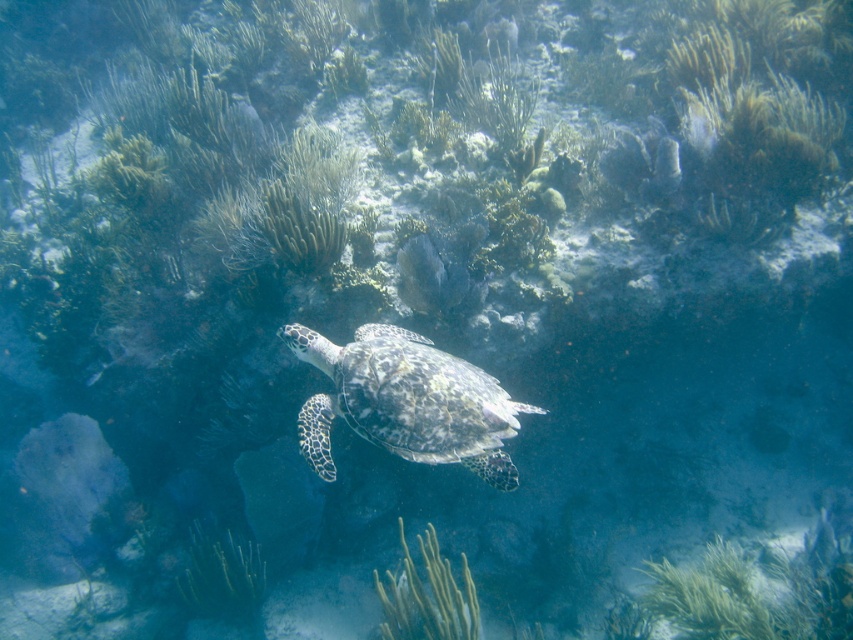
You are a marine biologist observing the underwater scene. You notice two points marked in the image. Which point is closer to you, point (399, 403) or point (392, 602)?

Point (399, 403) is closer to the viewer than point (392, 602).

You are a marine biologist observing the underwater scene. You notice the speckled shell turtle at center and the green soft coral at center. Which object is taller in this environment?

The green soft coral at center is taller than the speckled shell turtle at center.

You are a marine biologist observing the underwater scene. You notice the speckled shell turtle at center and the green soft coral at center. Which object is positioned higher in the water column?

The speckled shell turtle at center is above the green soft coral at center, so it is positioned higher in the water column.